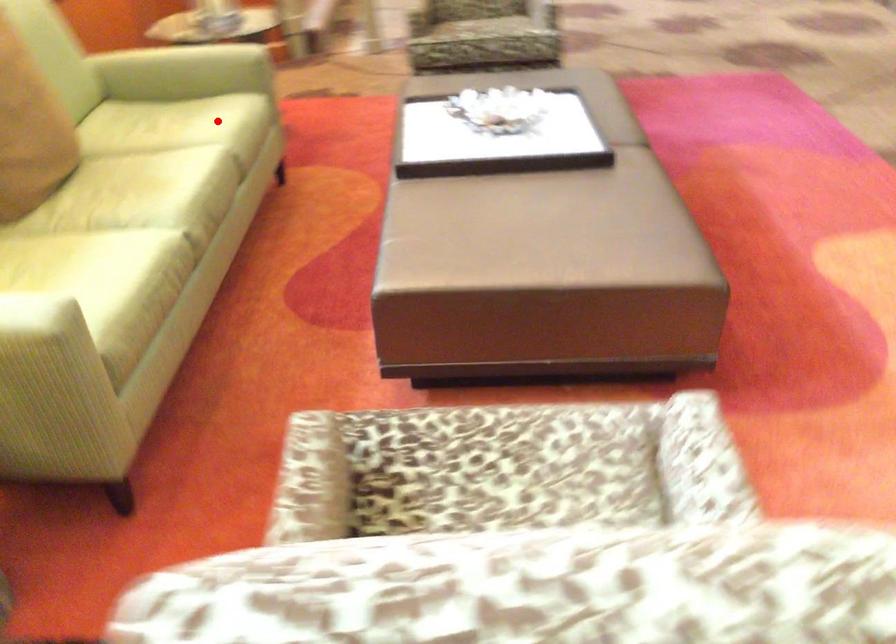
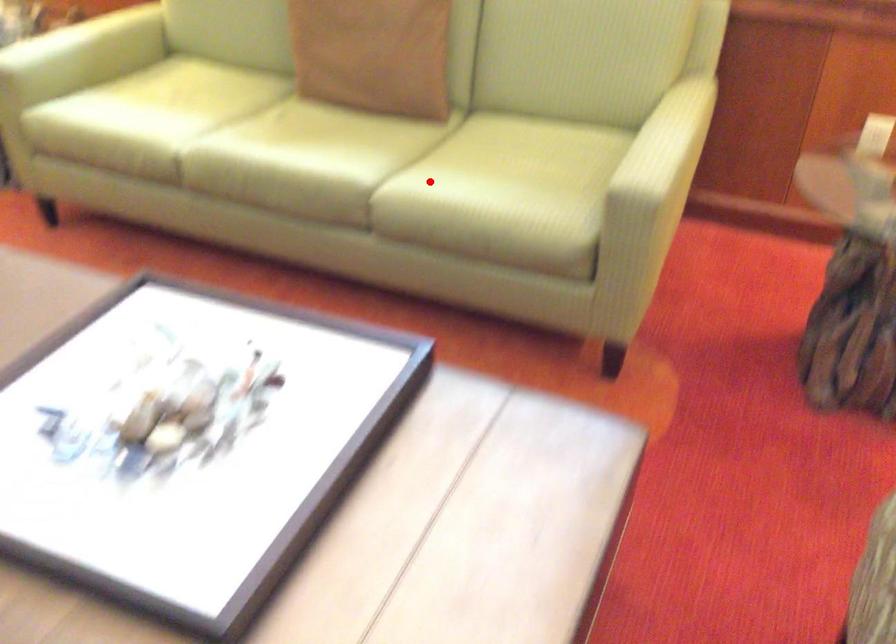
I am providing you with two images of the same scene from different viewpoints. A red point is marked on the first image and another point is marked on the second image. Is the red point in image1 aligned with the point shown in image2?

Yes